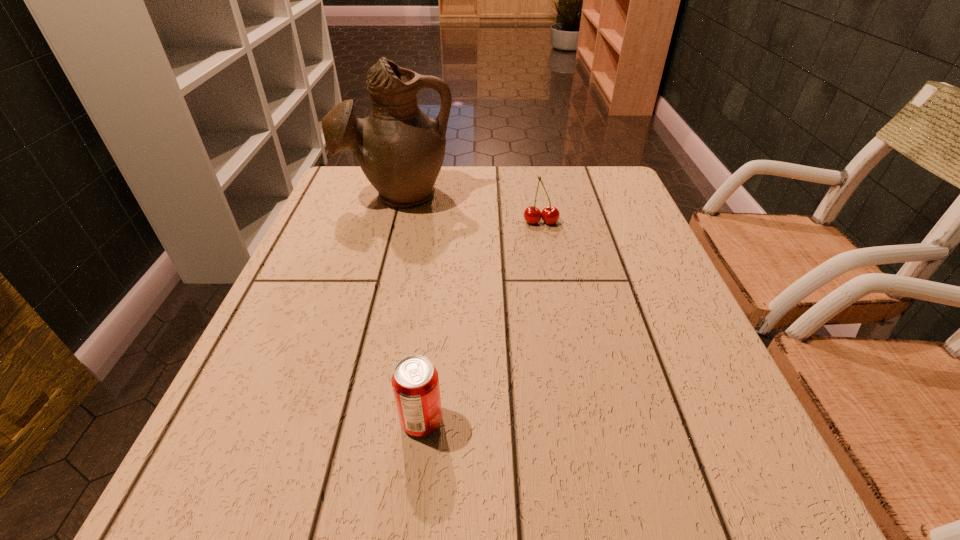
This screenshot has width=960, height=540. Find the location of `the tallest object`. the tallest object is located at coordinates (400, 149).

Where is `the nearest object`? The image size is (960, 540). the nearest object is located at coordinates (415, 381).

Find the location of a particular element. cherry is located at coordinates coord(550,215).

At what (x,y) coordinates should I click in order to perform the action: click on vacant space located 0.100m at the spout of the tallest object. Please return your answer as a coordinate pair (x, y). The width and height of the screenshot is (960, 540). Looking at the image, I should click on (386, 241).

This screenshot has width=960, height=540. Find the location of `vacant region located 0.370m on the right of the soda`. vacant region located 0.370m on the right of the soda is located at coordinates (x=683, y=421).

Find the location of a particular element. free space located with the stems of the cherry pointing upwards is located at coordinates (547, 258).

Image resolution: width=960 pixels, height=540 pixels. In order to click on object that is positioned at the far edge in this screenshot , I will do `click(400, 149)`.

Find the location of a particular element. object that is at the left edge is located at coordinates (400, 149).

I want to click on object that is at the far left corner, so click(x=400, y=149).

In order to click on vacant space at the far edge of the desktop in this screenshot , I will do `click(508, 187)`.